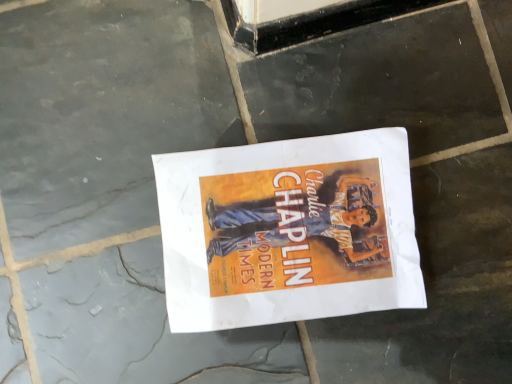
Find the location of a particular element. Image resolution: width=512 pixels, height=384 pixels. white paper poster at center is located at coordinates (288, 231).

Describe the element at coordinates (288, 231) in the screenshot. I see `white paper poster at center` at that location.

The width and height of the screenshot is (512, 384). In order to click on white paper poster at center in this screenshot , I will do `click(288, 231)`.